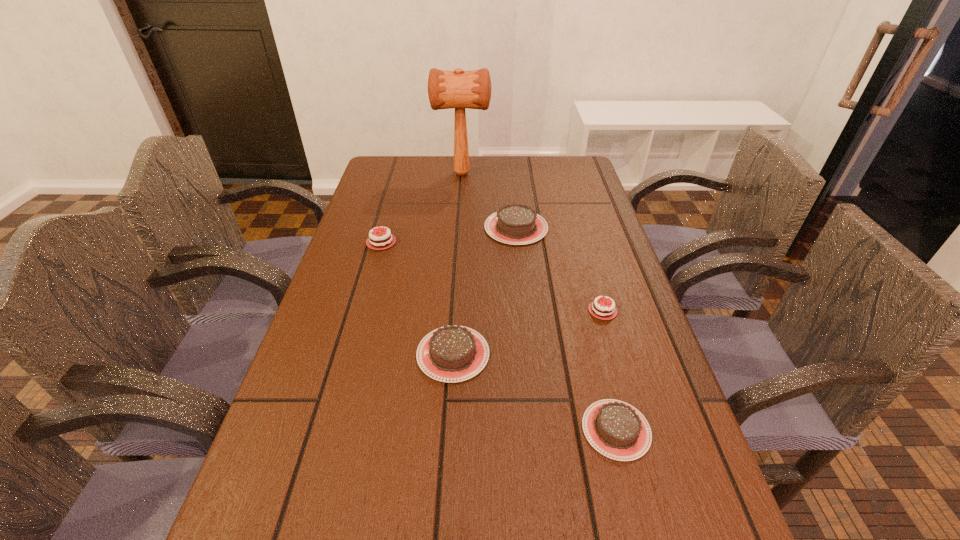
Find the location of a particular element. This screenshot has width=960, height=540. the farthest object is located at coordinates (458, 89).

Image resolution: width=960 pixels, height=540 pixels. Identify the location of mallet. (458, 89).

In order to click on the biggest brown chocolate cake in this screenshot , I will do `click(515, 224)`.

Where is `the biggest red chocolate cake`? the biggest red chocolate cake is located at coordinates (375, 245).

You are a GUI agent. You are given a task and a screenshot of the screen. Output one action in this format:
    pyautogui.click(x=<x>, y=<y>)
    Task: Click on the leftmost red chocolate cake
    The width and height of the screenshot is (960, 540).
    Given the screenshot: What is the action you would take?
    pyautogui.click(x=375, y=245)

This screenshot has width=960, height=540. In order to click on the second nearest brown chocolate cake in this screenshot , I will do `click(454, 353)`.

Find the location of a particular element. The height and width of the screenshot is (540, 960). the second nearest red chocolate cake is located at coordinates (602, 311).

The height and width of the screenshot is (540, 960). Find the location of `the rightmost red chocolate cake`. the rightmost red chocolate cake is located at coordinates (602, 311).

This screenshot has height=540, width=960. In order to click on the nearest brown chocolate cake in this screenshot , I will do `click(617, 430)`.

You are a GUI agent. You are given a task and a screenshot of the screen. Output one action in this format:
    pyautogui.click(x=<x>, y=<y>)
    Task: Click on the second nearest chocolate cake
    
    Given the screenshot: What is the action you would take?
    pyautogui.click(x=617, y=430)